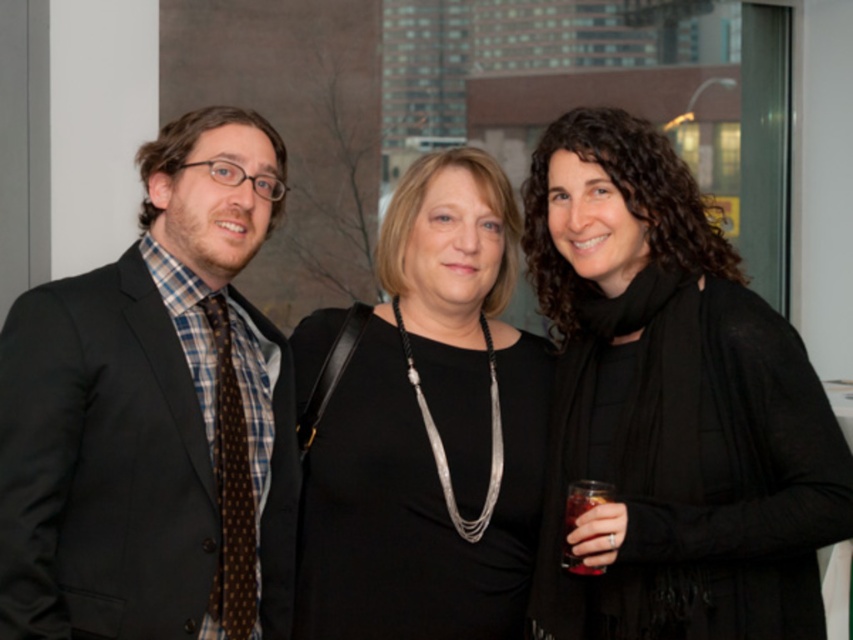
Question: Which point is farther to the camera?

Choices:
 (A) (341, 403)
 (B) (570, 515)
 (C) (561, 404)
 (D) (131, 484)

Answer: (C)

Question: Considering the real-world distances, which object is closest to the matte black suit at left?

Choices:
 (A) black sheer scarf at center
 (B) black matte dress at center
 (C) translucent glass at right

Answer: (B)

Question: Which of the following is the closest to the observer?

Choices:
 (A) black sheer scarf at center
 (B) matte black suit at left
 (C) black matte dress at center
 (D) translucent glass at right

Answer: (B)

Question: Is black sheer scarf at center positioned in front of black matte dress at center?

Choices:
 (A) no
 (B) yes

Answer: (B)

Question: Is black matte dress at center positioned in front of translucent glass at right?

Choices:
 (A) yes
 (B) no

Answer: (B)

Question: From the image, what is the correct spatial relationship of black matte dress at center in relation to translucent glass at right?

Choices:
 (A) above
 (B) below

Answer: (A)